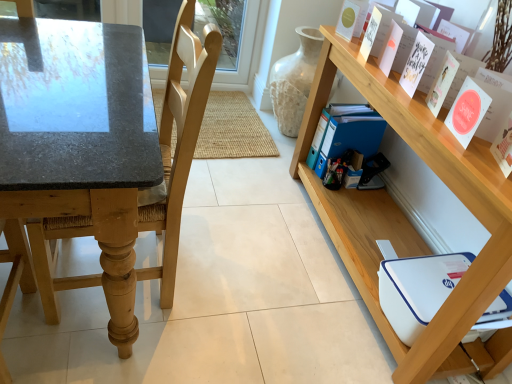
Question: From a real-world perspective, is wooden shelf at upper right above or below white matte paper at upper right, marked as the 6th paperback book in a back-to-front arrangement?

Choices:
 (A) above
 (B) below

Answer: (B)

Question: Considering the positions of point (415, 137) and point (498, 150), is point (415, 137) closer or farther from the camera than point (498, 150)?

Choices:
 (A) closer
 (B) farther

Answer: (B)

Question: Estimate the real-world distances between objects in this image. Which object is farther from the blue plastic folder at lower right, which is counted as the fifth paperback book, starting from the front?

Choices:
 (A) pink matte paper at upper right, placed as the fourth paperback book when sorted from front to back
 (B) white matte paper at upper right, marked as the 6th paperback book in a back-to-front arrangement
 (C) matte pink card at upper right, which is the fifth paperback book in back-to-front order
 (D) white paper at upper right, positioned as the fourth paperback book in back-to-front order
 (E) blue plastic folder at center-right, which appears as the sixth paperback book when viewed from the front

Answer: (B)

Question: Estimate the real-world distances between objects in this image. Which object is farther from the wooden shelf at upper right?

Choices:
 (A) matte pink card at upper right, the 2th paperback book viewed from the front
 (B) white matte paper at upper right, marked as the 6th paperback book in a back-to-front arrangement
 (C) white paper card at upper right
 (D) translucent glass vase at upper right
 (E) white paper at upper right, the 3th paperback book when ordered from front to back

Answer: (D)